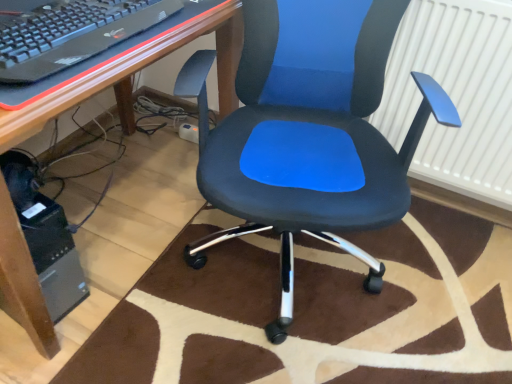
Find the location of a particular element. free space between black plastic computer tower at lower left and brown plush rug at center is located at coordinates (134, 247).